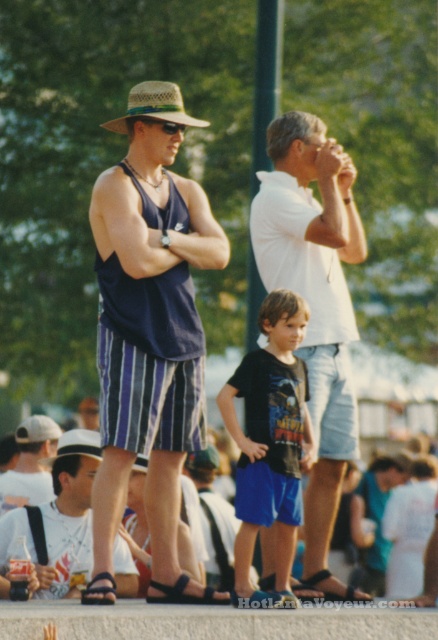
Question: Which of the following is the farthest from the observer?

Choices:
 (A) (289, 292)
 (B) (342, 433)
 (C) (4, 518)

Answer: (C)

Question: Which point is closer to the camera?

Choices:
 (A) (137, 97)
 (B) (317, 460)
 (C) (244, 515)

Answer: (C)

Question: Which point is closer to the camera taking this photo?

Choices:
 (A) (87, 499)
 (B) (296, 179)
 (C) (176, 104)

Answer: (C)

Question: Can you confirm if white cotton shirt at center is positioned to the left of black cotton shirt at center?

Choices:
 (A) no
 (B) yes

Answer: (A)

Question: Can you confirm if matte blue tank top at center is smaller than black cotton shirt at center?

Choices:
 (A) yes
 (B) no

Answer: (B)

Question: Is black cotton shirt at center closer to the viewer compared to straw hat at center?

Choices:
 (A) no
 (B) yes

Answer: (B)